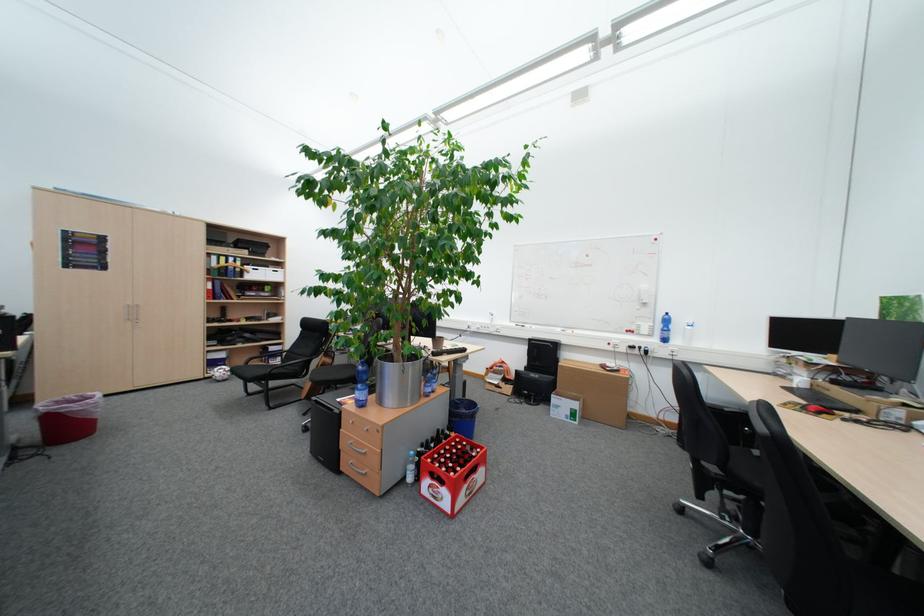
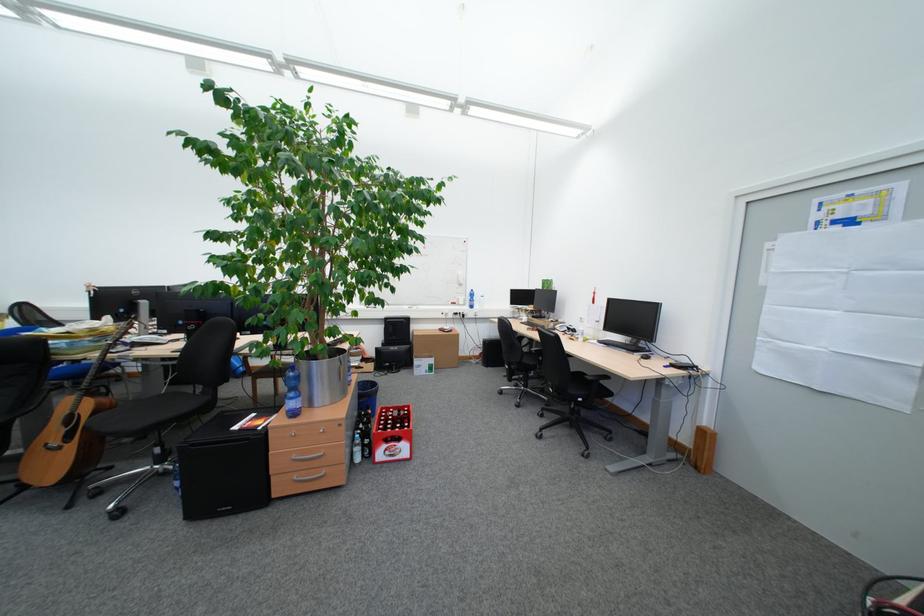
Locate, in the second image, the point that corresponds to point 334,367 in the first image.

(110, 411)